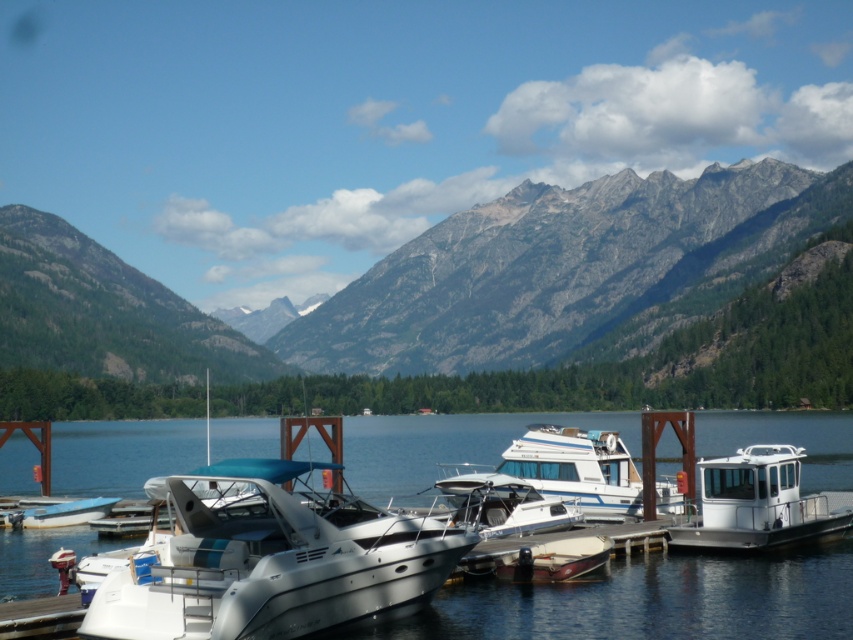
In the scene shown: You are planning to take a photo of the white glossy houseboat at center and the gray rocky mountain at left. Which object should you place on the left side of your camera frame to ensure both are visible?

You should place the gray rocky mountain at left on the left side of your camera frame because it is already to the right of the white glossy houseboat at center, so positioning the mountain on the left will keep both within the frame.

You are standing at the point closer to the mountains in the scene. Which point are you at, point (683, 317) or point (372, 490)?

You are at point (372, 490) because it is closer to the mountains in the scene, while point (683, 317) is behind it.